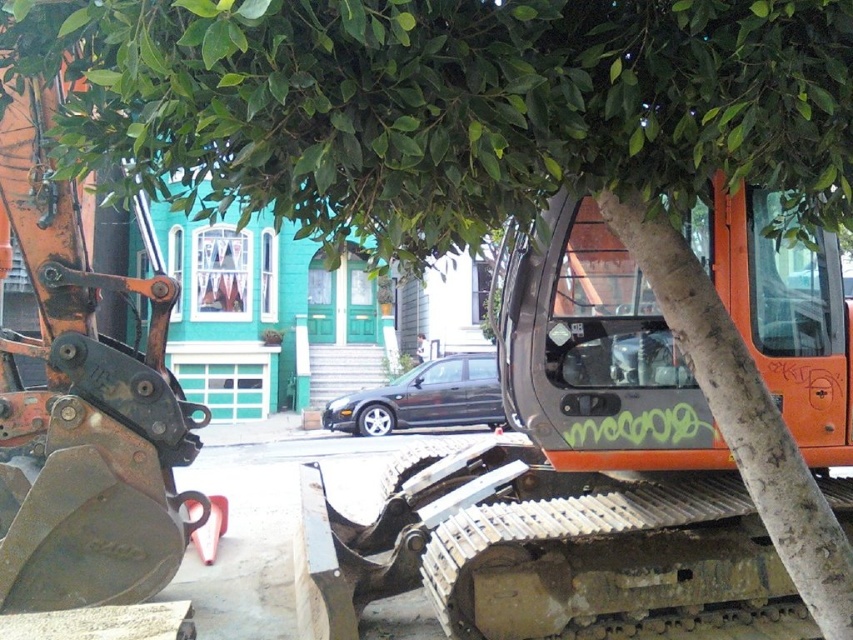
In the scene shown: Can you confirm if green leafy tree at upper center is smaller than rusty metal excavator at left?

Yes, green leafy tree at upper center is smaller than rusty metal excavator at left.

Can you confirm if green leafy tree at upper center is thinner than rusty metal excavator at left?

Incorrect, green leafy tree at upper center's width is not less than rusty metal excavator at left's.

Between point (514, 99) and point (67, 268), which one is positioned behind?

Positioned behind is point (67, 268).

The image size is (853, 640). What are the coordinates of `green leafy tree at upper center` in the screenshot? It's located at (453, 109).